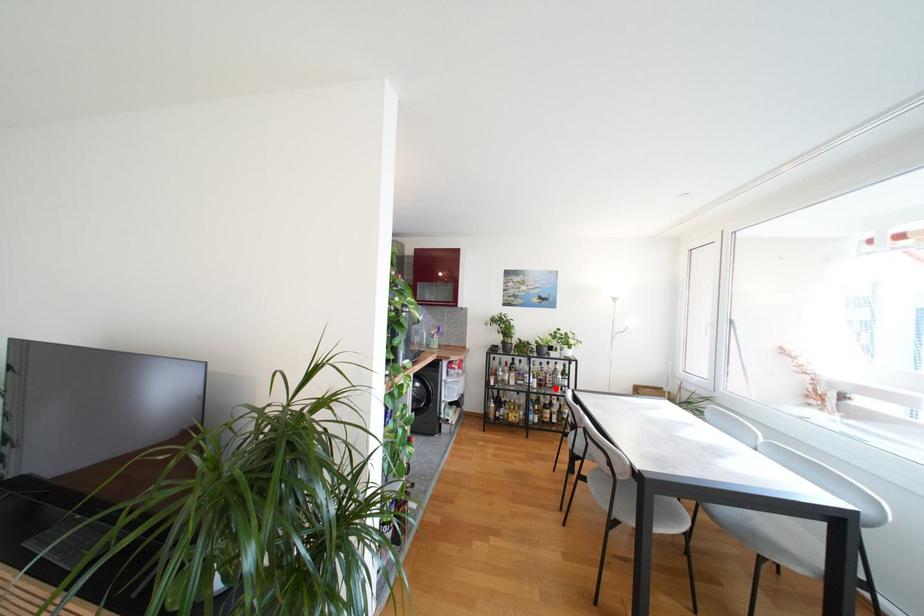
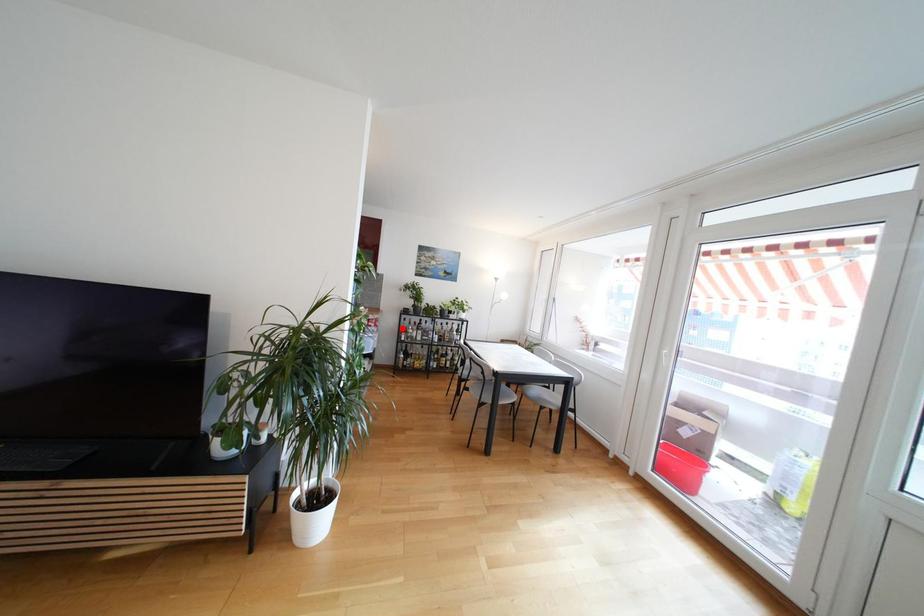
I am providing you with two images of the same scene from different viewpoints. A red point is marked on the first image and another point is marked on the second image. Do the highlighted points in image1 and image2 indicate the same real-world spot?

No